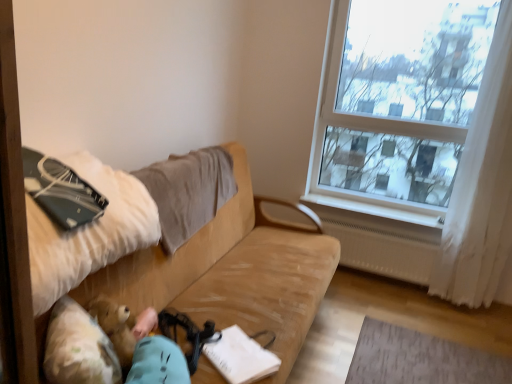
Question: Looking at their shapes, would you say transparent glass window at upper right is wider or thinner than beige fabric pillow at upper left?

Choices:
 (A) wide
 (B) thin

Answer: (B)

Question: Is transparent glass window at upper right taller or shorter than beige fabric pillow at upper left?

Choices:
 (A) tall
 (B) short

Answer: (A)

Question: Which object is positioned closest to the white plastic radiator at lower right?

Choices:
 (A) beige fabric couch at center
 (B) white paper at center
 (C) transparent glass window at upper right
 (D) fluffy beige teddy bear at lower left
 (E) matte black notebook at left

Answer: (C)

Question: Which of these objects is positioned farthest from the white paper at center?

Choices:
 (A) matte black notebook at left
 (B) beige fabric pillow at upper left
 (C) transparent glass window at upper right
 (D) fluffy beige teddy bear at lower left
 (E) white sheer curtain at right

Answer: (C)